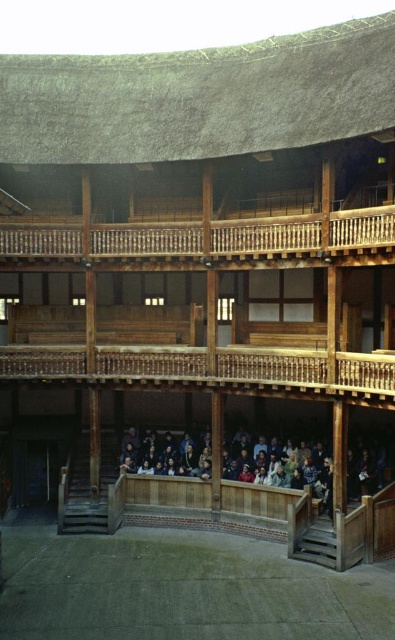
You are an architect inspecting the old wooden structure. You notice both a wooden balustrade at center and a wooden bench at center. Which object is shorter in height?

The wooden balustrade at center is shorter in height compared to the wooden bench at center.